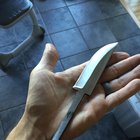
Where is `stool`? This screenshot has width=140, height=140. stool is located at coordinates (14, 8).